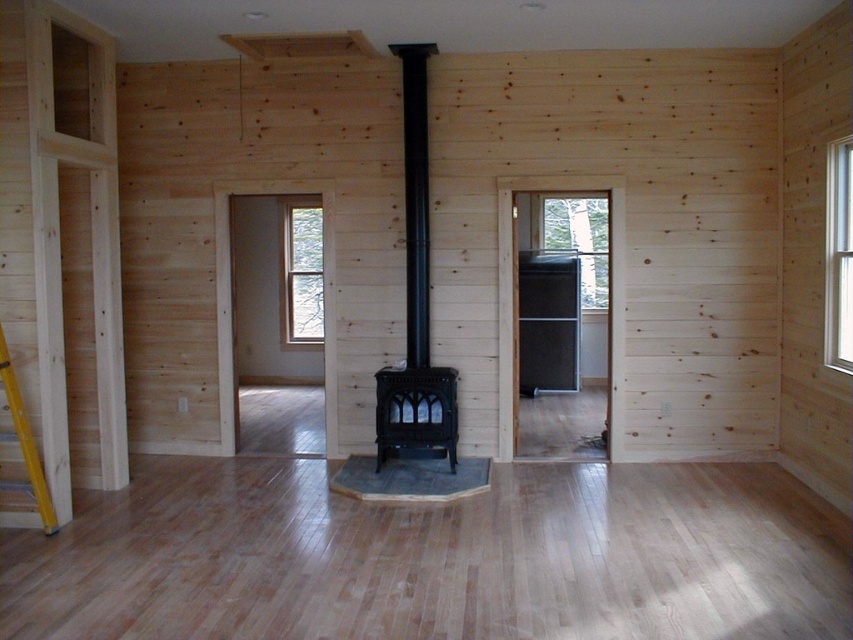
You are standing at point [4,369] and want to move to point [383,371]. Is the point you want to reach in front of or behind you?

The point [383,371] is behind point [4,369], so it is behind you.

You are standing in the room and want to place a decorative item on the black cast iron fireplace at center. To reach it, you need to climb the yellow wood ladder at left. Is the ladder positioned in a way that allows you to access the fireplace?

The black cast iron fireplace at center is located above the yellow wood ladder at left, so the ladder is placed below the fireplace. This means you can climb the ladder to reach the fireplace safely.

You are planning to place a new rug in the room. The rug you have is large enough to cover the black matte fireplace at center and the yellow wood ladder at left. Given their sizes, which object will require more of the rug to cover it?

The yellow wood ladder at left requires more of the rug to cover it because the black matte fireplace at center has a smaller size compared to yellow wood ladder at left.